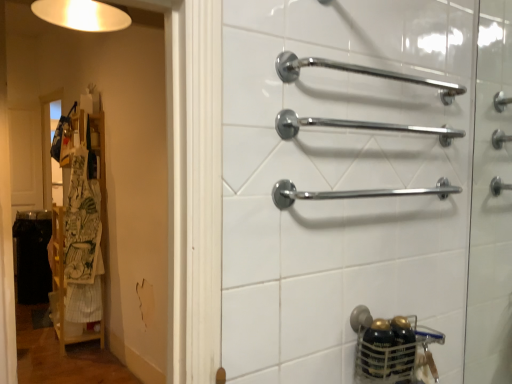
I want to click on white cotton apron at left, so click(x=83, y=244).

Measure the distance between wooden rack at left and camera.

wooden rack at left and camera are 2.72 meters apart.

What do you see at coordinates (354, 193) in the screenshot?
I see `polished chrome towel bar at center, which appears as the first towel rack when ordered from the bottom` at bounding box center [354, 193].

Locate an element on the screen. This screenshot has width=512, height=384. chrome metallic grab bars at right is located at coordinates (490, 204).

Locate an element on the screen. The width and height of the screenshot is (512, 384). white cotton apron at left is located at coordinates (83, 244).

Is wooden rack at left further to the viewer compared to chrome metallic grab bars at right?

Yes, it is.

In terms of size, does wooden rack at left appear bigger or smaller than chrome metallic grab bars at right?

In the image, wooden rack at left appears to be larger than chrome metallic grab bars at right.

Is wooden rack at left beside chrome metallic grab bars at right?

No, wooden rack at left is not in contact with chrome metallic grab bars at right.

In the scene shown: From the image's perspective, which object appears higher, wooden rack at left or chrome metallic towel rack at center, the second towel rack positioned from the top?

chrome metallic towel rack at center, the second towel rack positioned from the top, from the image's perspective.

How different are the orientations of wooden rack at left and chrome metallic towel rack at center, the second towel rack positioned from the top, in degrees?

wooden rack at left and chrome metallic towel rack at center, the second towel rack positioned from the top, are facing 88.8 degrees away from each other.

Visually, is wooden rack at left positioned to the left or to the right of chrome metallic towel rack at center, the 2th towel rack when ordered from bottom to top?

Clearly, wooden rack at left is on the left of chrome metallic towel rack at center, the 2th towel rack when ordered from bottom to top, in the image.

From the image's perspective, which one is positioned higher, chrome metallic grab bars at right or chrome metallic towel rack at upper center, the 3th towel rack in the bottom-to-top sequence?

chrome metallic towel rack at upper center, the 3th towel rack in the bottom-to-top sequence, appears higher in the image.

Considering the relative positions of chrome metallic grab bars at right and chrome metallic towel rack at upper center, the 3th towel rack in the bottom-to-top sequence, in the image provided, is chrome metallic grab bars at right in front of chrome metallic towel rack at upper center, the 3th towel rack in the bottom-to-top sequence,?

No.

Looking at this image, is chrome metallic grab bars at right positioned with its back to chrome metallic towel rack at upper center, positioned as the first towel rack in top-to-bottom order?

That's right, chrome metallic grab bars at right is facing away from chrome metallic towel rack at upper center, positioned as the first towel rack in top-to-bottom order.

Is chrome metallic grab bars at right placed right next to chrome metallic towel rack at upper center, positioned as the first towel rack in top-to-bottom order?

No, chrome metallic grab bars at right is not next to chrome metallic towel rack at upper center, positioned as the first towel rack in top-to-bottom order.

From a real-world perspective, is chrome metallic grab bars at right physically below white cotton apron at left?

No, from a real-world perspective, chrome metallic grab bars at right is not under white cotton apron at left.

Consider the image. Is there a large distance between chrome metallic grab bars at right and white cotton apron at left?

Yes, chrome metallic grab bars at right and white cotton apron at left are quite far apart.

Image resolution: width=512 pixels, height=384 pixels. What are the coordinates of `screen door that is on the right side of white cotton apron at left` in the screenshot? It's located at (490, 204).

Considering the positions of objects chrome metallic grab bars at right and white cotton apron at left in the image provided, who is in front, chrome metallic grab bars at right or white cotton apron at left?

Positioned in front is chrome metallic grab bars at right.

Is point (87, 175) closer or farther from the camera than point (74, 301)?

Point (87, 175) appears to be farther away from the viewer than point (74, 301).

Which object is wider, wooden rack at left or white cotton apron at left?

wooden rack at left is wider.

From a real-world perspective, is wooden rack at left above or below white cotton apron at left?

From a real-world perspective, wooden rack at left is physically below white cotton apron at left.

Are wooden rack at left and white cotton apron at left beside each other?

Yes, the surface of wooden rack at left is in contact with white cotton apron at left.

From a real-world perspective, relative to white cotton apron at left, is chrome metallic towel rack at upper center, the 3th towel rack in the bottom-to-top sequence, vertically above or below?

From a real-world perspective, chrome metallic towel rack at upper center, the 3th towel rack in the bottom-to-top sequence, is physically above white cotton apron at left.

Does chrome metallic towel rack at upper center, positioned as the first towel rack in top-to-bottom order, have a larger size compared to white cotton apron at left?

Incorrect, chrome metallic towel rack at upper center, positioned as the first towel rack in top-to-bottom order, is not larger than white cotton apron at left.

Considering the relative sizes of chrome metallic towel rack at upper center, the 3th towel rack in the bottom-to-top sequence, and white cotton apron at left in the image provided, is chrome metallic towel rack at upper center, the 3th towel rack in the bottom-to-top sequence, shorter than white cotton apron at left?

Correct, chrome metallic towel rack at upper center, the 3th towel rack in the bottom-to-top sequence, is not as tall as white cotton apron at left.

Is chrome metallic towel rack at upper center, positioned as the first towel rack in top-to-bottom order, behind white cotton apron at left?

No, it is not.

Identify the location of screen door above the wooden rack at left (from a real-world perspective). This screenshot has height=384, width=512. (490, 204).

Is point (488, 279) positioned behind point (77, 128)?

No.

From the image's perspective, which is above, chrome metallic grab bars at right or wooden rack at left?

Answer: chrome metallic grab bars at right, from the image's perspective.

From the picture: Between chrome metallic grab bars at right and wooden rack at left, which one has smaller width?

Thinner between the two is chrome metallic grab bars at right.

Where is `screen door above the wooden rack at left (from a real-world perspective)`? This screenshot has height=384, width=512. screen door above the wooden rack at left (from a real-world perspective) is located at coordinates (490, 204).

The image size is (512, 384). Identify the location of the 2nd towel rack above when counting from the wooden rack at left (from the image's perspective). (357, 126).

Based on the photo, which object lies nearer to the anchor point chrome metallic towel rack at center, the second towel rack positioned from the top, chrome metallic grab bars at right or chrome metallic towel rack at upper center, positioned as the first towel rack in top-to-bottom order?

chrome metallic towel rack at upper center, positioned as the first towel rack in top-to-bottom order, is positioned closer to the anchor chrome metallic towel rack at center, the second towel rack positioned from the top.

Looking at the image, which one is located closer to chrome metallic towel rack at upper center, positioned as the first towel rack in top-to-bottom order, white cotton apron at left or chrome metallic grab bars at right?

chrome metallic grab bars at right lies closer to chrome metallic towel rack at upper center, positioned as the first towel rack in top-to-bottom order, than the other object.

Which object lies further to the anchor point chrome metallic towel rack at center, the second towel rack positioned from the top, white cotton apron at left or chrome metallic towel rack at upper center, positioned as the first towel rack in top-to-bottom order?

white cotton apron at left is positioned further to the anchor chrome metallic towel rack at center, the second towel rack positioned from the top.

Considering their positions, is polished chrome towel bar at center, which is the 3th towel rack from top to bottom, positioned further to chrome metallic grab bars at right than wooden rack at left?

The object further to chrome metallic grab bars at right is wooden rack at left.

When comparing their distances from white cotton apron at left, does chrome metallic towel rack at upper center, the 3th towel rack in the bottom-to-top sequence, or chrome metallic grab bars at right seem closer?

chrome metallic towel rack at upper center, the 3th towel rack in the bottom-to-top sequence.

Estimate the real-world distances between objects in this image. Which object is closer to chrome metallic grab bars at right, chrome metallic towel rack at center, the 2th towel rack when ordered from bottom to top, or polished chrome towel bar at center, which is the 3th towel rack from top to bottom?

polished chrome towel bar at center, which is the 3th towel rack from top to bottom, is positioned closer to the anchor chrome metallic grab bars at right.

Which object lies nearer to the anchor point chrome metallic towel rack at upper center, the 3th towel rack in the bottom-to-top sequence, chrome metallic grab bars at right or chrome metallic towel rack at center, the 2th towel rack when ordered from bottom to top?

chrome metallic towel rack at center, the 2th towel rack when ordered from bottom to top.

Looking at the image, which one is located closer to chrome metallic grab bars at right, chrome metallic towel rack at upper center, the 3th towel rack in the bottom-to-top sequence, or polished chrome towel bar at center, which appears as the first towel rack when ordered from the bottom?

polished chrome towel bar at center, which appears as the first towel rack when ordered from the bottom, lies closer to chrome metallic grab bars at right than the other object.

Image resolution: width=512 pixels, height=384 pixels. Find the location of `towel rack that lies between chrome metallic towel rack at upper center, the 3th towel rack in the bottom-to-top sequence, and polished chrome towel bar at center, which appears as the first towel rack when ordered from the bottom, from top to bottom`. towel rack that lies between chrome metallic towel rack at upper center, the 3th towel rack in the bottom-to-top sequence, and polished chrome towel bar at center, which appears as the first towel rack when ordered from the bottom, from top to bottom is located at coordinates (357, 126).

Locate an element on the screen. laundry between chrome metallic towel rack at center, the 2th towel rack when ordered from bottom to top, and wooden rack at left from front to back is located at coordinates (83, 244).

Where is `laundry located between polished chrome towel bar at center, which is the 3th towel rack from top to bottom, and wooden rack at left in the depth direction`? Image resolution: width=512 pixels, height=384 pixels. laundry located between polished chrome towel bar at center, which is the 3th towel rack from top to bottom, and wooden rack at left in the depth direction is located at coordinates (83, 244).

At what (x,y) coordinates should I click in order to perform the action: click on towel rack between chrome metallic towel rack at upper center, positioned as the first towel rack in top-to-bottom order, and chrome metallic grab bars at right from left to right. Please return your answer as a coordinate pair (x, y). Looking at the image, I should click on (357, 126).